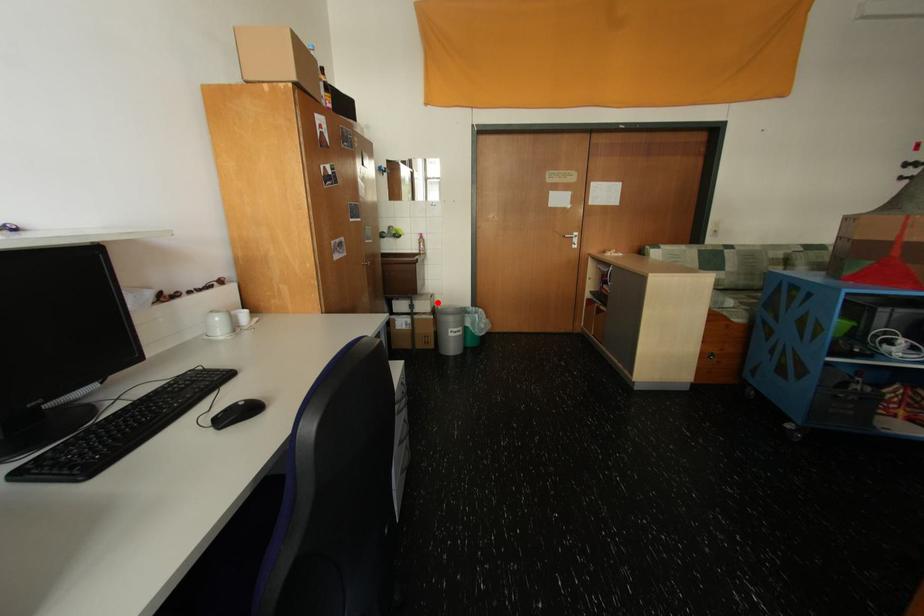
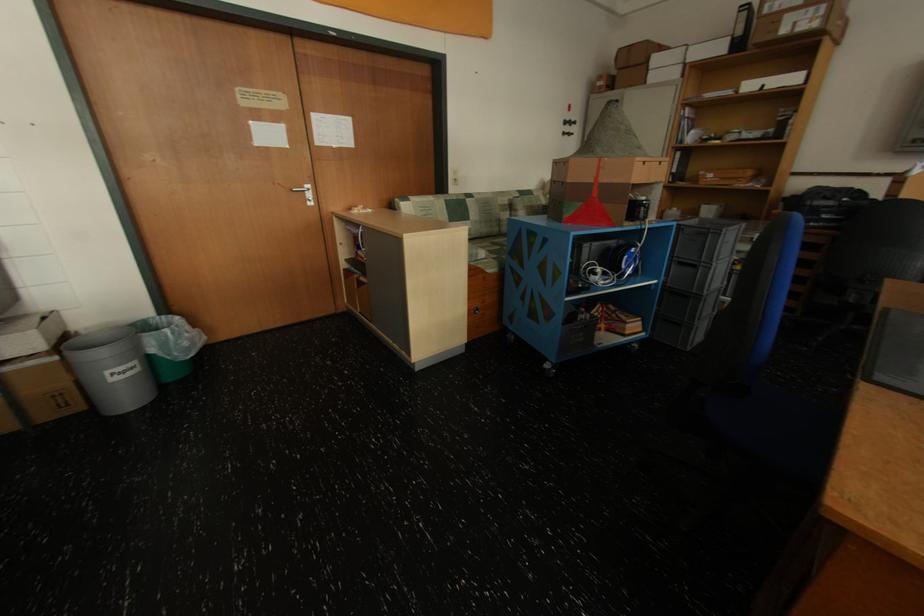
The point at the highlighted location is marked in the first image. Where is the corresponding point in the second image?

(43, 333)